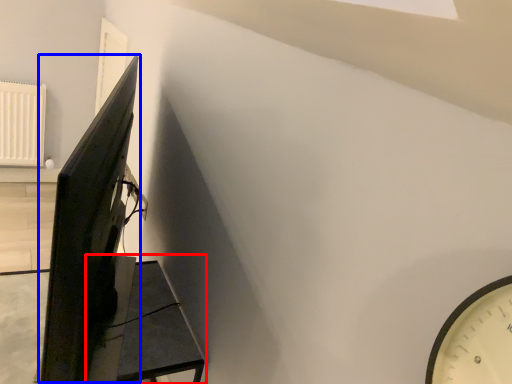
Question: Which object is further to the camera taking this photo, furniture (highlighted by a red box) or computer monitor (highlighted by a blue box)?

Choices:
 (A) furniture
 (B) computer monitor

Answer: (A)